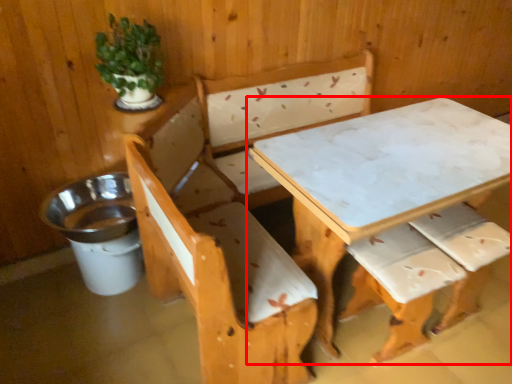
Question: From the image's perspective, considering the relative positions of table (annotated by the red box) and houseplant in the image provided, where is table (annotated by the red box) located with respect to the staircase?

Choices:
 (A) above
 (B) below

Answer: (B)